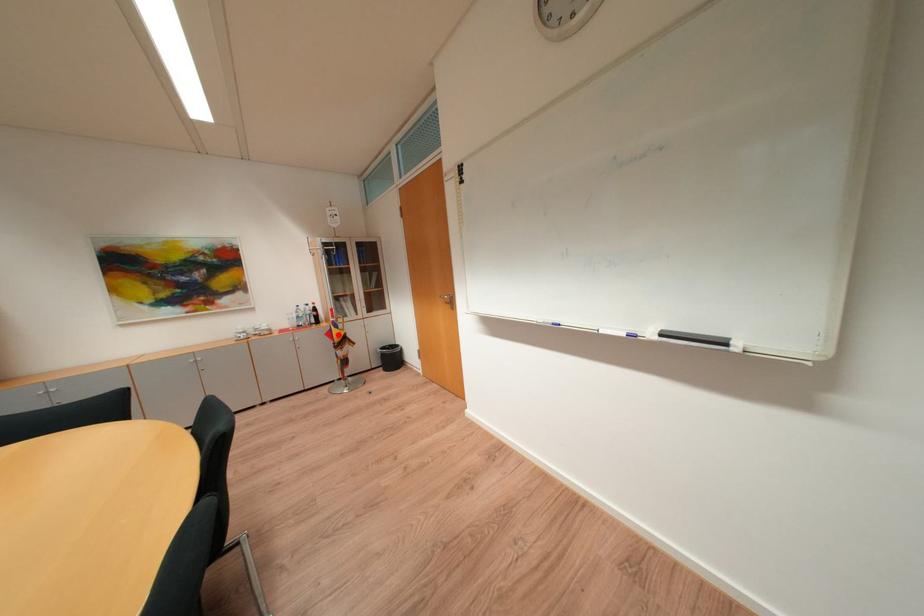
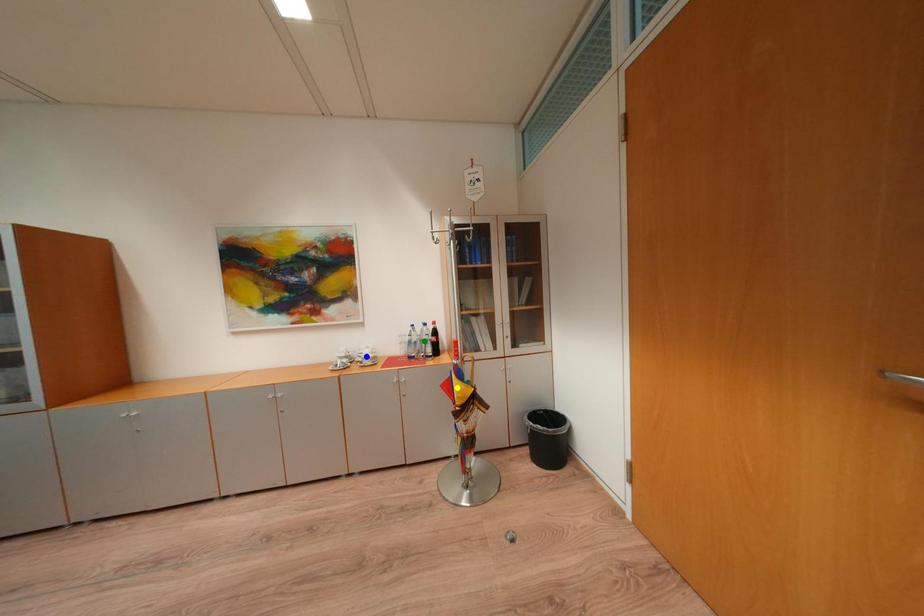
Question: I am providing you with two images of the same scene from different viewpoints. A red point is marked on the first image. You are given multiple points on the second image. Can you choose the point in image 2 that corresponds to the point in image 1?

Choices:
 (A) green point
 (B) blue point
 (C) yellow point

Answer: (C)